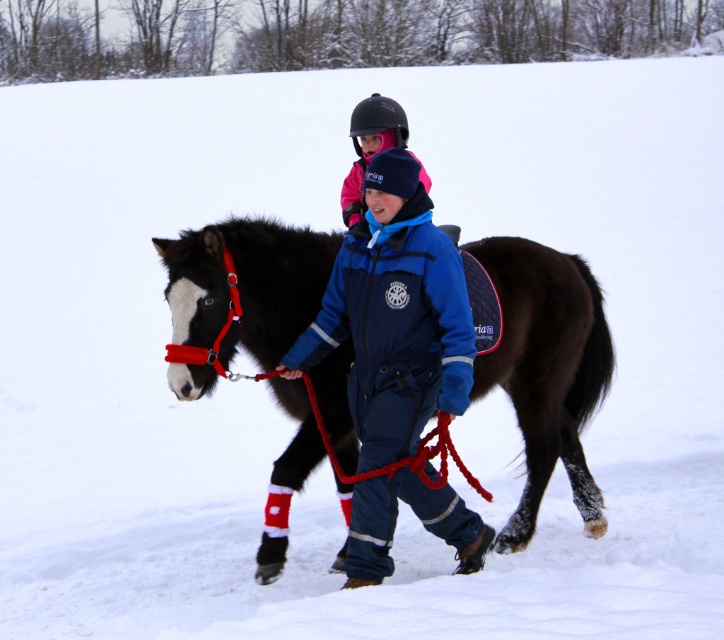
Which of these two, black glossy horse at center or pink matte helmet at upper center, stands shorter?

pink matte helmet at upper center is shorter.

The image size is (724, 640). I want to click on black glossy horse at center, so click(547, 365).

Which is in front, point (214, 280) or point (439, 492)?

Point (214, 280)

Does point (523, 316) lie in front of point (379, 513)?

That is False.

Locate an element on the screen. Image resolution: width=724 pixels, height=640 pixels. black glossy horse at center is located at coordinates (547, 365).

Based on the photo, which is above, blue fleece jacket at center or pink matte helmet at upper center?

Positioned higher is pink matte helmet at upper center.

Is point (379, 228) positioned after point (382, 108)?

No.

I want to click on blue fleece jacket at center, so click(395, 316).